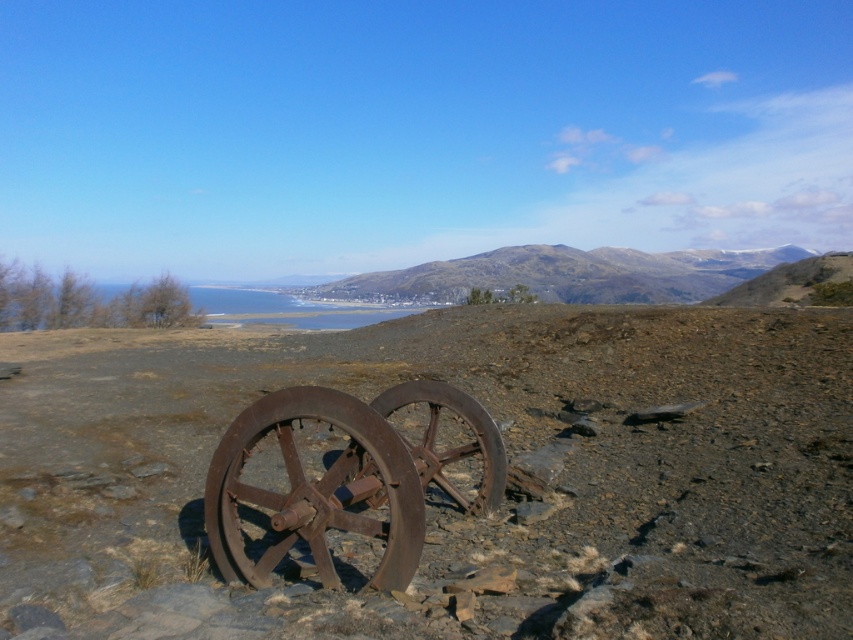
Question: Which point is farther to the camera?

Choices:
 (A) rusty metal wagon wheel at center
 (B) rusty metallic dirt field at center
 (C) rusty metal wheel at center

Answer: (C)

Question: Where is rusty metallic dirt field at center located in relation to rusty metal wagon wheel at center in the image?

Choices:
 (A) left
 (B) right

Answer: (B)

Question: Among these points, which one is nearest to the camera?

Choices:
 (A) (479, 490)
 (B) (334, 502)

Answer: (B)

Question: Can you confirm if rusty metal wagon wheel at center is positioned above rusty metal wheel at center?

Choices:
 (A) yes
 (B) no

Answer: (B)

Question: Can you confirm if rusty metallic dirt field at center is positioned below rusty metal wagon wheel at center?

Choices:
 (A) yes
 (B) no

Answer: (B)

Question: Among these points, which one is nearest to the camera?

Choices:
 (A) (614, 262)
 (B) (582, 368)
 (C) (331, 492)

Answer: (C)